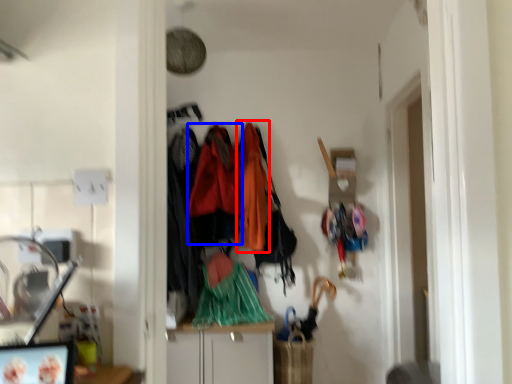
Question: Which of the following is the farthest to the observer, clothing (highlighted by a red box) or clothing (highlighted by a blue box)?

Choices:
 (A) clothing
 (B) clothing

Answer: (A)